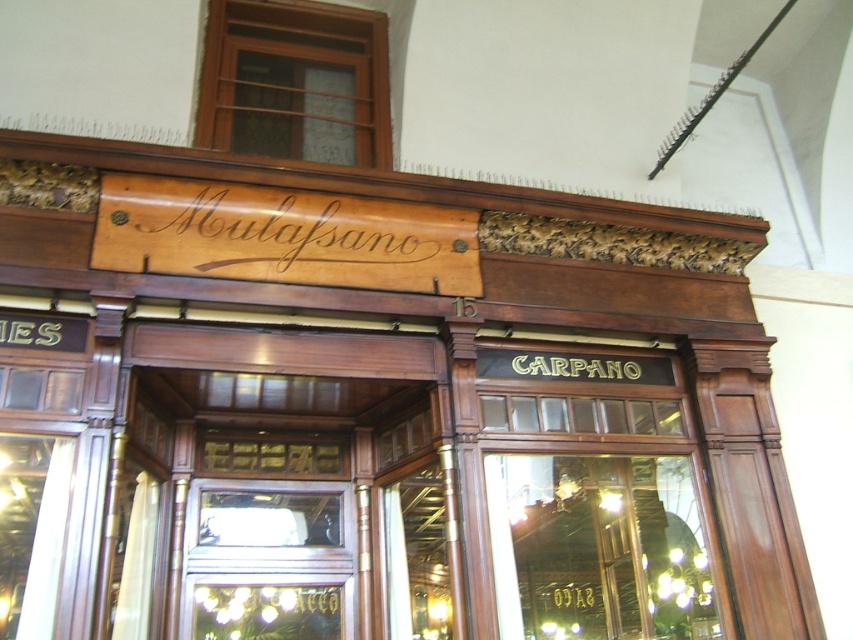
You are a delivery person trying to enter the store through the transparent glass door at center. The wooden sign at center is blocking your path. Can you pass through the door without moving the sign?

The transparent glass door at center is thinner than wooden sign at center, so the door is narrower than the sign. Since the wooden sign at center is blocking your path and is wider, you cannot pass through the door without moving the sign.

You are standing in front of the storefront and want to enter. Where is the transparent glass door at center located in terms of coordinates?

The transparent glass door at center is located at point coordinates of (x=598, y=547).

You are a delivery person approaching the storefront. You need to enter through the transparent glass door at center. Is the wooden sign at center blocking your path?

The transparent glass door at center is in front of the wooden sign at center, so the wooden sign at center is behind the door and does not block your path.